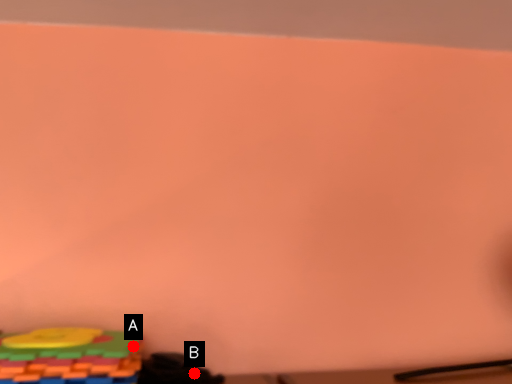
Question: Two points are circled on the image, labeled by A and B beside each circle. Among these points, which one is nearest to the camera?

Choices:
 (A) A is closer
 (B) B is closer

Answer: (A)